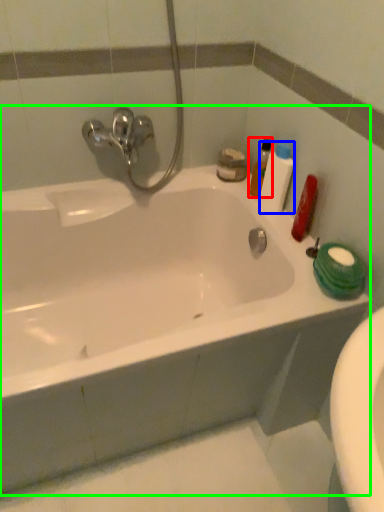
Question: Which object is positioned closest to cleaning product (highlighted by a red box)? Select from toiletry (highlighted by a blue box) and bathtub (highlighted by a green box).

Choices:
 (A) toiletry
 (B) bathtub

Answer: (A)